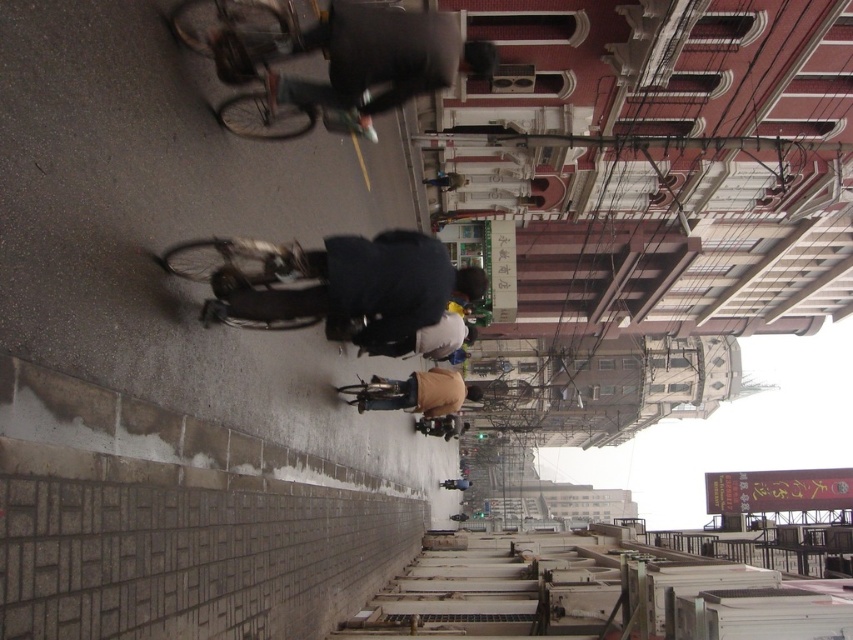
Which is below, dark blue fabric jacket at center or shiny metallic bicycle at center?

shiny metallic bicycle at center

Does point (361, 342) come closer to viewer compared to point (184, 269)?

That is False.

Find the location of a particular element. The image size is (853, 640). dark blue fabric jacket at center is located at coordinates (352, 285).

Does shiny metallic bicycle at center appear over tan fabric pants at center?

Indeed, shiny metallic bicycle at center is positioned over tan fabric pants at center.

Between shiny metallic bicycle at center and tan fabric pants at center, which one appears on the left side from the viewer's perspective?

shiny metallic bicycle at center

Describe the element at coordinates (236, 262) in the screenshot. I see `shiny metallic bicycle at center` at that location.

At what (x,y) coordinates should I click in order to perform the action: click on shiny metallic bicycle at center. Please return your answer as a coordinate pair (x, y). Image resolution: width=853 pixels, height=640 pixels. Looking at the image, I should click on (236, 262).

Between point (437, 312) and point (442, 374), which one is positioned in front?

Point (437, 312) is more forward.

Does dark blue fabric jacket at center appear on the left side of tan fabric pants at center?

Correct, you'll find dark blue fabric jacket at center to the left of tan fabric pants at center.

Which is in front, point (274, 257) or point (424, 404)?

Point (274, 257) is more forward.

You are a GUI agent. You are given a task and a screenshot of the screen. Output one action in this format:
    pyautogui.click(x=<x>, y=<y>)
    Task: Click on the dark blue fabric jacket at center
    
    Given the screenshot: What is the action you would take?
    pyautogui.click(x=352, y=285)